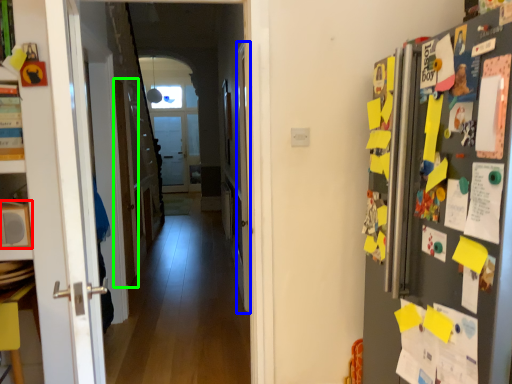
Question: Which is farther away from appliance (highlighted by a red box)? door (highlighted by a blue box) or door (highlighted by a green box)?

Choices:
 (A) door
 (B) door

Answer: (B)